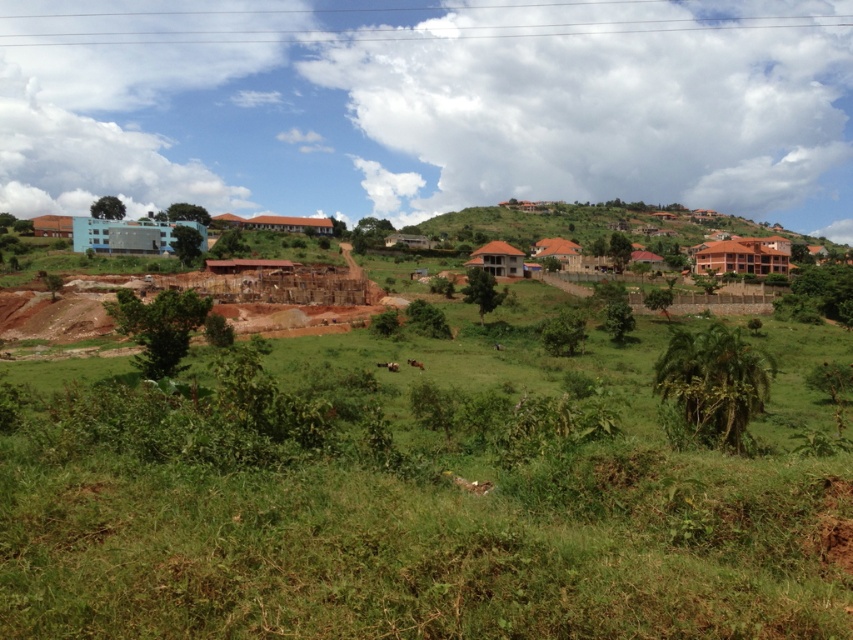
Question: Can you confirm if green grassy field at center is positioned to the left of blue glass building at upper left?

Choices:
 (A) yes
 (B) no

Answer: (B)

Question: Does brown wooden house at center appear over matte brick hut at left?

Choices:
 (A) yes
 (B) no

Answer: (B)

Question: Which point appears closest to the camera in this image?

Choices:
 (A) (511, 272)
 (B) (840, 488)
 (C) (570, 269)
 (D) (56, 227)

Answer: (B)

Question: Which point appears closest to the camera in this image?

Choices:
 (A) (167, 394)
 (B) (764, 257)
 (C) (64, 230)
 (D) (573, 269)

Answer: (A)

Question: Does brown matte building at right appear on the left side of brown corrugated metal hut at center-right?

Choices:
 (A) no
 (B) yes

Answer: (A)

Question: Which object appears farthest from the camera in this image?

Choices:
 (A) brown matte building at right
 (B) blue glass building at upper left
 (C) brown corrugated metal hut at center-right

Answer: (A)